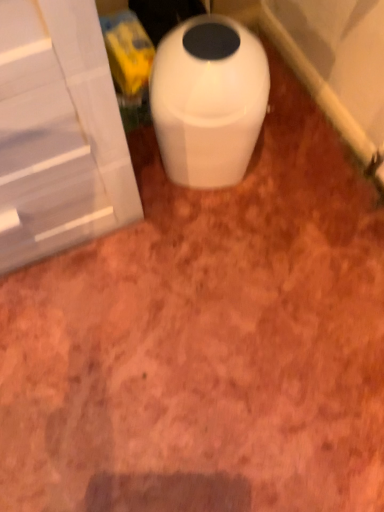
I want to click on vacant space to the right of white glossy screen door at left, so click(221, 231).